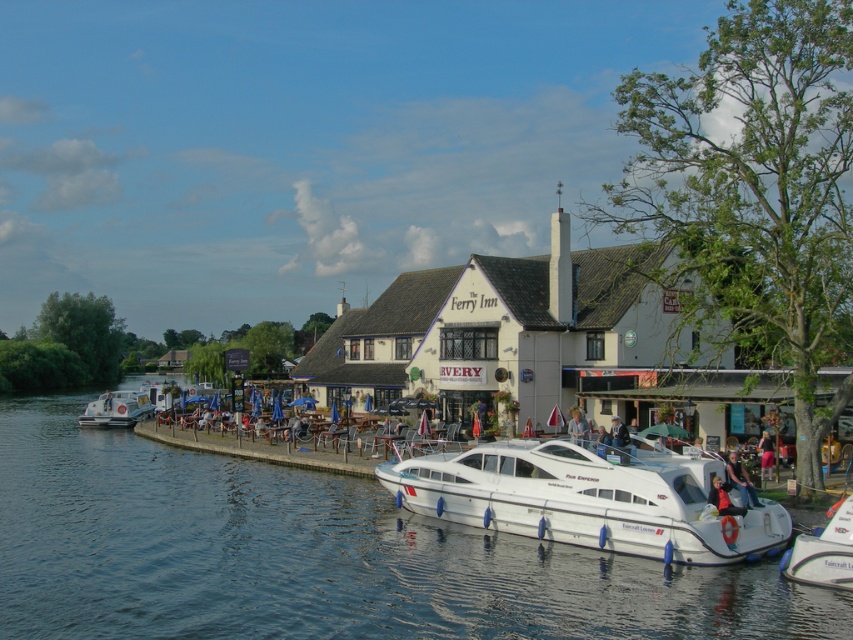
Which is below, white glossy motorboat at center or light brown wooden chair at center?

white glossy motorboat at center is below.

Who is taller, white glossy motorboat at center or light brown wooden chair at center?

white glossy motorboat at center

Which is in front, point (601, 449) or point (582, 435)?

Point (601, 449) is more forward.

Find the location of `white glossy motorboat at center`. white glossy motorboat at center is located at coordinates (585, 499).

Is point (274, 618) positioned before point (772, 532)?

Yes, it is.

Can you confirm if blue water at lower left is smaller than white glossy motorboat at center?

Actually, blue water at lower left might be larger than white glossy motorboat at center.

Identify the location of blue water at lower left. Image resolution: width=853 pixels, height=640 pixels. coord(316,556).

Does white glossy boat at lower right have a greater height compared to blue denim jacket at center?

Yes.

In the scene shown: Which of these two, white glossy boat at lower right or blue denim jacket at center, stands taller?

Standing taller between the two is white glossy boat at lower right.

Does point (813, 579) come behind point (612, 436)?

That is False.

I want to click on white glossy boat at lower right, so click(822, 552).